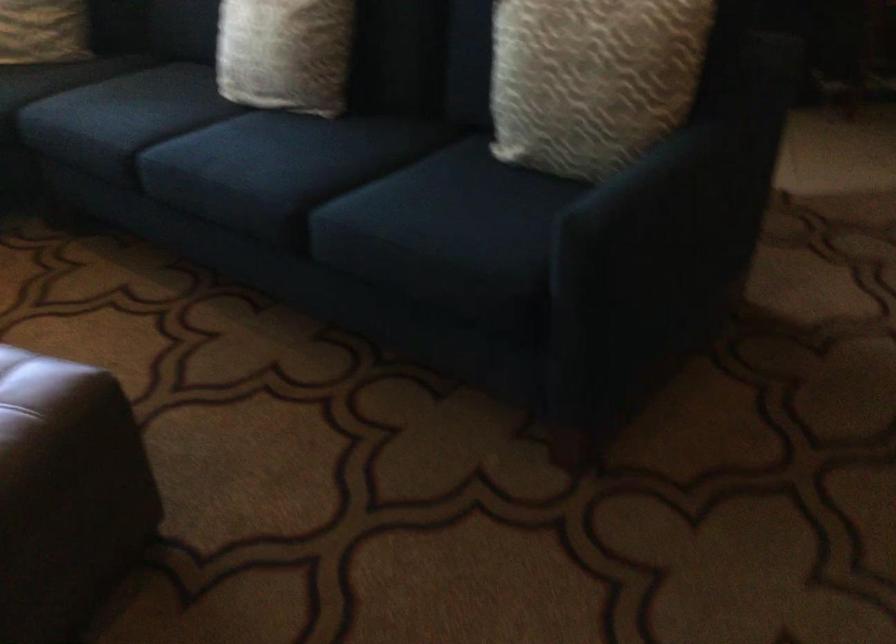
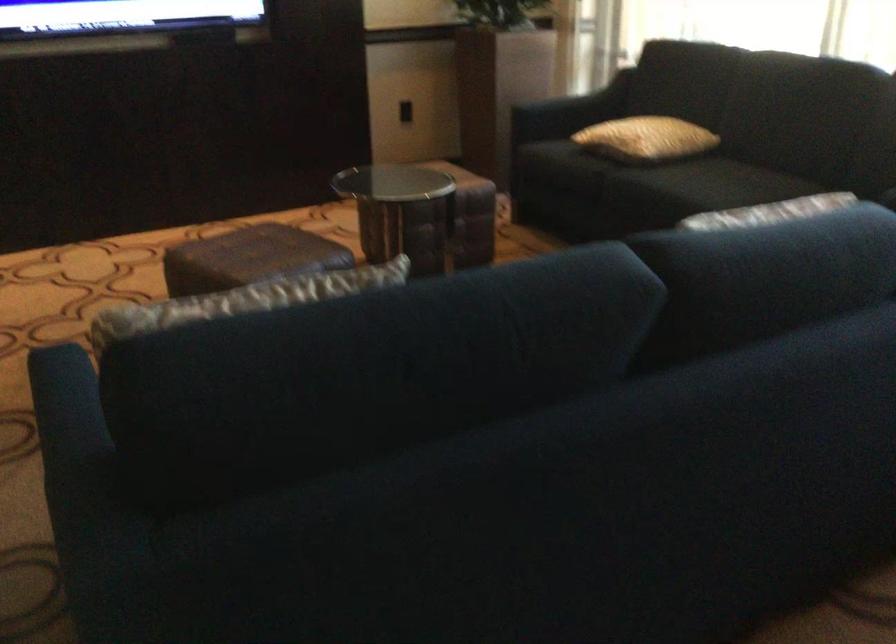
In the second image, find the point that corresponds to pixel 682 143 in the first image.

(69, 431)